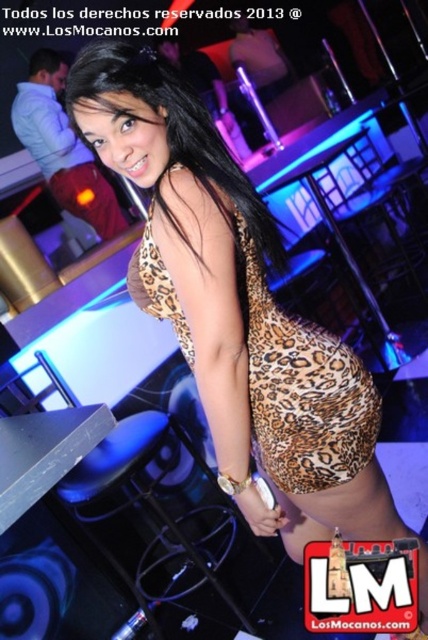
In the nightclub scene, there is a woman wearing a leopard print dress at center. A point has been marked at coordinates (x=300, y=387). Is this point located on the leopard print dress?

Yes, the point at (x=300, y=387) is located on the leopard print dress at center as stated in the description.

You are a photographer trying to capture the leopard print dress at center and the matte black bartender at upper left in a single shot. Based on their sizes in the image, which object would appear smaller in the final photo?

The leopard print dress at center appears smaller in the final photo because it has a lesser width compared to the matte black bartender at upper left.

You are a dancer in the nightclub and need to quickly move from the leopard print dress at center to the matte black bartender at upper left to grab a drink. Given that you can move at a speed of 1 meter per second, how many seconds will it take you to reach the bartender?

The distance between the leopard print dress at center and the matte black bartender at upper left is 2.40 meters. Since you move at 1 meter per second, it will take you 2.40 seconds to reach the bartender.